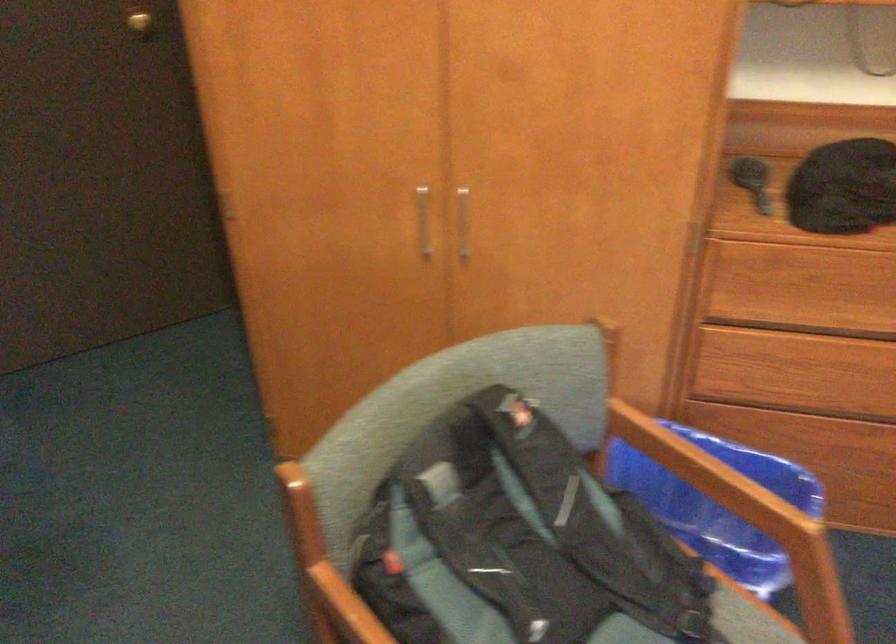
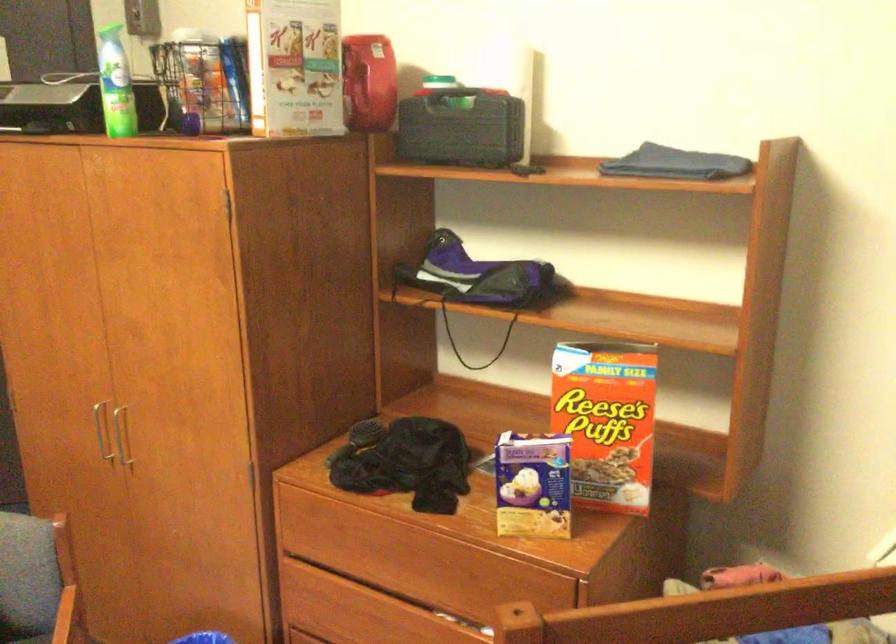
Question: The images are taken continuously from a first-person perspective. In which direction are you moving?

Choices:
 (A) Left
 (B) Right
 (C) Forward
 (D) Backward

Answer: (B)